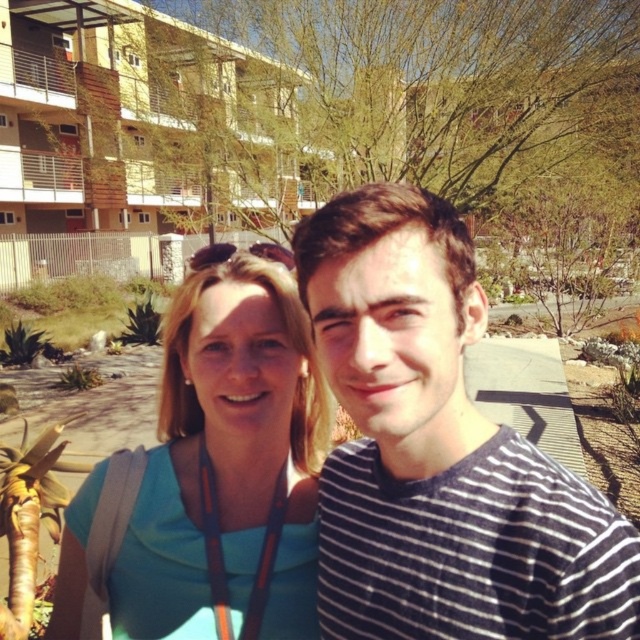
Who is more distant from viewer, (616, 627) or (260, 298)?

Point (260, 298)

In the scene shown: Which is below, striped cotton shirt at center or blue fabric shirt at center?

blue fabric shirt at center is below.

Is point (387, 404) positioned after point (176, 410)?

No, (387, 404) is in front of (176, 410).

Find the location of a particular element. striped cotton shirt at center is located at coordinates (440, 451).